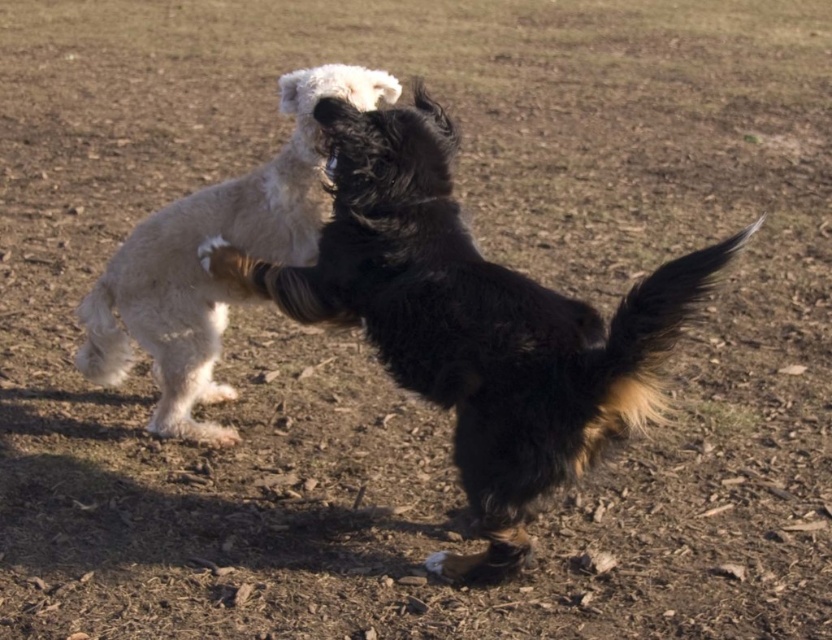
You are standing 10 feet away from the fluffy black dog at center. Can you safely throw a ball to it without stepping forward?

The fluffy black dog at center and viewer are 9.50 feet apart from each other. Since you are standing 10 feet away, you are slightly farther than the actual distance. However, the difference is minimal, so you might be able to throw the ball to the fluffy black dog at center without needing to step forward.